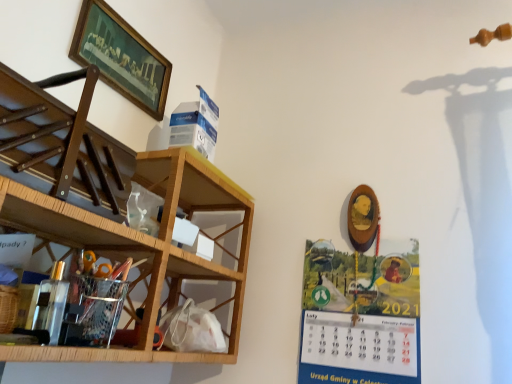
Question: From a real-world perspective, is wooden framed painting at upper left under metallic silver organizer at lower left, which is counted as the first shelf, starting from the bottom?

Choices:
 (A) no
 (B) yes

Answer: (A)

Question: Would you say wooden framed painting at upper left is outside metallic silver organizer at lower left, the third shelf from the top?

Choices:
 (A) no
 (B) yes

Answer: (B)

Question: Is wooden framed painting at upper left bigger than metallic silver organizer at lower left, the third shelf from the top?

Choices:
 (A) yes
 (B) no

Answer: (B)

Question: Does wooden framed painting at upper left have a lesser width compared to metallic silver organizer at lower left, which is counted as the first shelf, starting from the bottom?

Choices:
 (A) no
 (B) yes

Answer: (B)

Question: Is there a large distance between wooden framed painting at upper left and metallic silver organizer at lower left, which is counted as the first shelf, starting from the bottom?

Choices:
 (A) yes
 (B) no

Answer: (B)

Question: Does wooden framed painting at upper left contain metallic silver organizer at lower left, which is counted as the first shelf, starting from the bottom?

Choices:
 (A) yes
 (B) no

Answer: (B)

Question: Is wooden at left, the 3th shelf positioned from the bottom, thinner than wooden framed painting at upper left?

Choices:
 (A) no
 (B) yes

Answer: (A)

Question: Is wooden at left, the 3th shelf positioned from the bottom, positioned with its back to wooden framed painting at upper left?

Choices:
 (A) no
 (B) yes

Answer: (A)

Question: Is the position of wooden at left, the 3th shelf positioned from the bottom, more distant than that of wooden framed painting at upper left?

Choices:
 (A) yes
 (B) no

Answer: (B)

Question: From a real-world perspective, is wooden at left, placed as the 1th shelf when sorted from top to bottom, located higher than wooden framed painting at upper left?

Choices:
 (A) yes
 (B) no

Answer: (B)

Question: Would you say wooden framed painting at upper left is part of wooden at left, placed as the 1th shelf when sorted from top to bottom,'s contents?

Choices:
 (A) yes
 (B) no

Answer: (B)

Question: Considering the relative positions of wooden at left, placed as the 1th shelf when sorted from top to bottom, and wooden framed painting at upper left in the image provided, is wooden at left, placed as the 1th shelf when sorted from top to bottom, in front of wooden framed painting at upper left?

Choices:
 (A) yes
 (B) no

Answer: (A)

Question: Is metallic silver organizer at lower left, the third shelf from the top, not near metallic calendar at right?

Choices:
 (A) no
 (B) yes

Answer: (A)